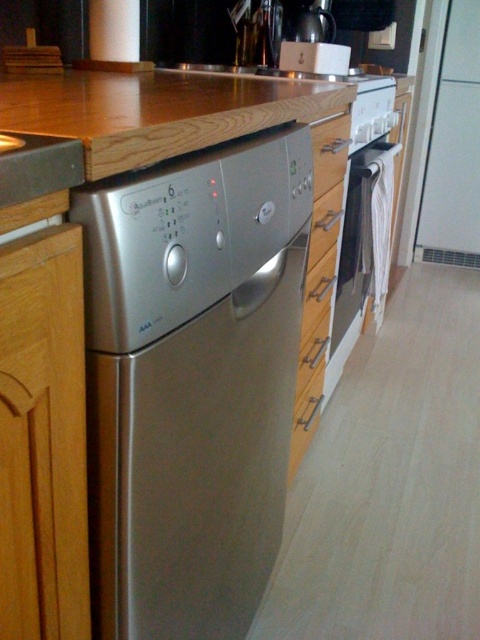
Measure the distance from satin silver dishwasher at center to white glossy oven at right.

satin silver dishwasher at center is 36.48 inches from white glossy oven at right.

In the scene shown: Does satin silver dishwasher at center have a greater width compared to white glossy oven at right?

In fact, satin silver dishwasher at center might be narrower than white glossy oven at right.

Who is more forward, (180, 240) or (369, 189)?

Point (180, 240) is more forward.

Locate an element on the screen. This screenshot has height=640, width=480. satin silver dishwasher at center is located at coordinates (192, 381).

Can you confirm if white glossy oven at right is positioned above satin wood drawer at center?

Indeed, white glossy oven at right is positioned over satin wood drawer at center.

Measure the distance between point (345, 216) and camera.

Point (345, 216) is 1.69 meters from camera.

Identify the location of white glossy oven at right. This screenshot has width=480, height=640. (361, 195).

Is satin silver dishwasher at center shorter than satin silver drawer at center?

Incorrect, satin silver dishwasher at center's height does not fall short of satin silver drawer at center's.

What do you see at coordinates (192, 381) in the screenshot?
I see `satin silver dishwasher at center` at bounding box center [192, 381].

Where is `satin silver dishwasher at center`? satin silver dishwasher at center is located at coordinates (192, 381).